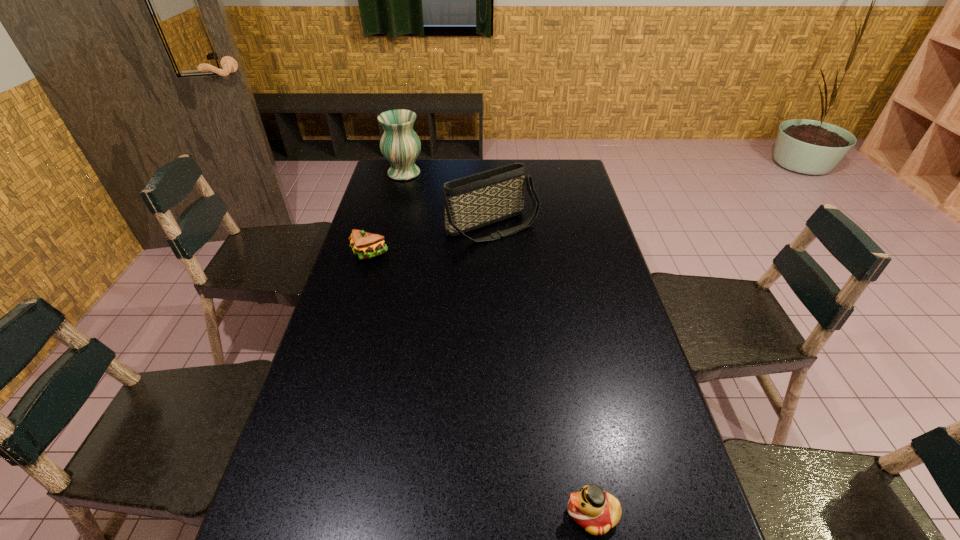
Find the location of a particular element. the tallest object is located at coordinates (400, 145).

Find the location of `vase`. vase is located at coordinates (400, 145).

Locate an element on the screen. This screenshot has width=960, height=540. handbag is located at coordinates (471, 202).

Where is `sandwich`? This screenshot has height=540, width=960. sandwich is located at coordinates pyautogui.click(x=366, y=245).

This screenshot has width=960, height=540. In order to click on the nearest object in this screenshot , I will do pyautogui.click(x=595, y=510).

At what (x,y) coordinates should I click in order to perform the action: click on free location located 0.240m on the front of the tallest object. Please return your answer as a coordinate pair (x, y). Looking at the image, I should click on (393, 215).

At what (x,y) coordinates should I click in order to perform the action: click on vacant space located 0.150m on the front of the handbag. Please return your answer as a coordinate pair (x, y). The image size is (960, 540). Looking at the image, I should click on (494, 276).

Find the location of `free space located 0.260m on the back of the sandwich`. free space located 0.260m on the back of the sandwich is located at coordinates (384, 204).

Where is `vacant space located on the face of the duck`? This screenshot has width=960, height=540. vacant space located on the face of the duck is located at coordinates (411, 514).

You are a GUI agent. You are given a task and a screenshot of the screen. Output one action in this format:
    pyautogui.click(x=<x>, y=<y>)
    Task: Click on the vacant space located 0.260m on the face of the duck
    This screenshot has height=540, width=960.
    Given the screenshot: What is the action you would take?
    pyautogui.click(x=436, y=514)